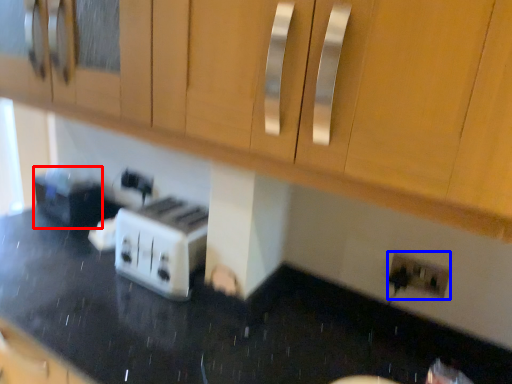
Question: Which object is closer to the camera taking this photo, appliance (highlighted by a red box) or electric outlet (highlighted by a blue box)?

Choices:
 (A) appliance
 (B) electric outlet

Answer: (B)